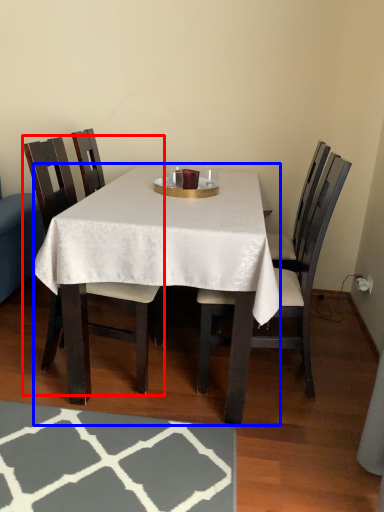
Question: Which of the following is the farthest to the observer, chair (highlighted by a red box) or desk (highlighted by a blue box)?

Choices:
 (A) chair
 (B) desk

Answer: (A)